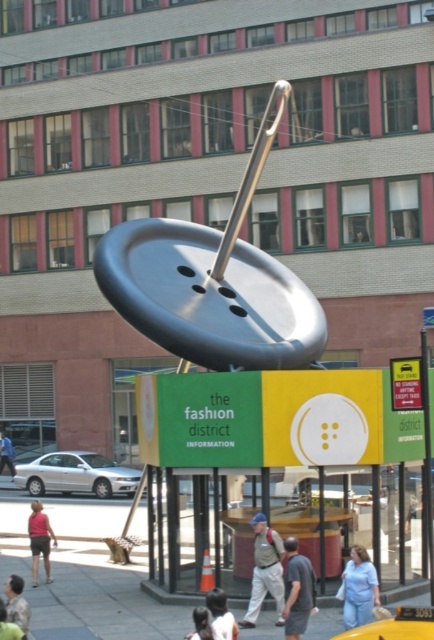
Which is more to the left, concrete sidewalk at lower center or denim pants at lower right?

concrete sidewalk at lower center

Does concrete sidewalk at lower center come behind denim pants at lower right?

Yes, concrete sidewalk at lower center is behind denim pants at lower right.

Does point (119, 604) come behind point (371, 568)?

Yes, it is behind point (371, 568).

Where is `concrete sidewalk at lower center`? Image resolution: width=434 pixels, height=640 pixels. concrete sidewalk at lower center is located at coordinates (94, 598).

Does khaki pants at center have a larger size compared to blonde hair at lower center?

Yes, khaki pants at center is bigger than blonde hair at lower center.

Is khaki pants at center thinner than blonde hair at lower center?

No.

Which is behind, point (279, 557) or point (203, 612)?

The point (279, 557) is more distant.

This screenshot has width=434, height=640. Identify the location of khaki pants at center. (266, 572).

Who is higher up, concrete sidewalk at lower center or khaki pants at center?

Positioned higher is khaki pants at center.

Which is below, concrete sidewalk at lower center or khaki pants at center?

concrete sidewalk at lower center is below.

This screenshot has height=640, width=434. I want to click on concrete sidewalk at lower center, so click(94, 598).

Identify the location of concrete sidewalk at lower center. (94, 598).